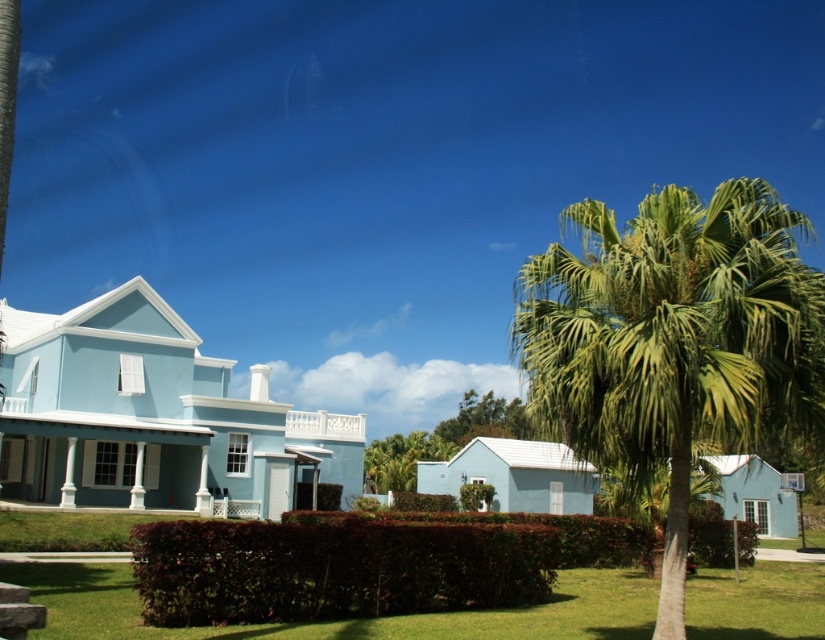
You are planning to install a new garden bench in the yard of the light blue colonial house. You want to place it between the green leafy palm tree at right and the green leafy tree at center. Which tree should the bench be closer to if you want it to be near the smaller tree?

The bench should be closer to the green leafy tree at center because it is the smaller of the two trees.

You are a gardener who needs to mow the green grass at lower center. The lawn mower you are using has a 4.5 feet turning radius. Can you navigate around the dark green leafy hedge at center without hitting it?

The distance between dark green leafy hedge at center and green grass at lower center is 8.96 feet. Since the lawn mower requires a 4.5 feet turning radius, the gardener can safely navigate around the hedge as the available space is more than sufficient for the required turning radius.

You are standing at the front porch of the light blue colonial house and want to place a small garden ornament exactly at the point marked by the coordinates point (333, 568). Based on the scene description, where would this point be located?

The point (333, 568) is located on the dark green leafy hedge at center, so placing the garden ornament there would position it on the hedge in the center of the scene.